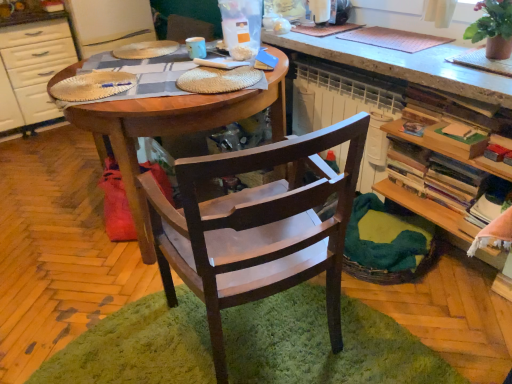
Question: Does wooden table at center have a lesser height compared to white glossy cabinet at left?

Choices:
 (A) yes
 (B) no

Answer: (A)

Question: Considering the relative sizes of wooden table at center and white glossy cabinet at left in the image provided, is wooden table at center bigger than white glossy cabinet at left?

Choices:
 (A) yes
 (B) no

Answer: (A)

Question: Is wooden table at center placed right next to white glossy cabinet at left?

Choices:
 (A) no
 (B) yes

Answer: (A)

Question: Does wooden table at center come behind white glossy cabinet at left?

Choices:
 (A) yes
 (B) no

Answer: (B)

Question: From a real-world perspective, is wooden table at center below white glossy cabinet at left?

Choices:
 (A) no
 (B) yes

Answer: (B)

Question: From a real-world perspective, is wooden bookshelf at right physically located above or below wooden table at center?

Choices:
 (A) above
 (B) below

Answer: (A)

Question: From the image's perspective, is wooden bookshelf at right above or below wooden table at center?

Choices:
 (A) below
 (B) above

Answer: (A)

Question: Is wooden bookshelf at right taller or shorter than wooden table at center?

Choices:
 (A) short
 (B) tall

Answer: (A)

Question: Would you say wooden bookshelf at right is to the left or to the right of wooden table at center in the picture?

Choices:
 (A) left
 (B) right

Answer: (B)

Question: Do you think dark wood chair at center is within green shaggy rug at center, or outside of it?

Choices:
 (A) outside
 (B) inside

Answer: (A)

Question: Relative to green shaggy rug at center, is dark wood chair at center in front or behind?

Choices:
 (A) behind
 (B) front

Answer: (A)

Question: Considering the positions of dark wood chair at center and green shaggy rug at center in the image, is dark wood chair at center bigger or smaller than green shaggy rug at center?

Choices:
 (A) small
 (B) big

Answer: (B)

Question: Is dark wood chair at center to the left or to the right of green shaggy rug at center in the image?

Choices:
 (A) left
 (B) right

Answer: (B)

Question: Is white glossy cabinet at left situated inside dark wood chair at center or outside?

Choices:
 (A) outside
 (B) inside

Answer: (A)

Question: Considering the positions of white glossy cabinet at left and dark wood chair at center in the image, is white glossy cabinet at left taller or shorter than dark wood chair at center?

Choices:
 (A) short
 (B) tall

Answer: (A)